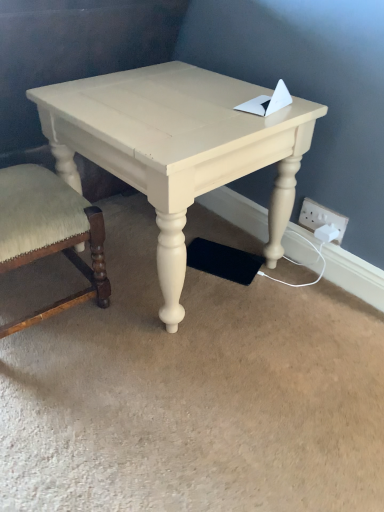
At what (x,y) coordinates should I click in order to perform the action: click on vacant space in between velvet beige chair at lower left and matte cream table at center. Please return your answer as a coordinate pair (x, y). This screenshot has width=384, height=512. Looking at the image, I should click on (93, 334).